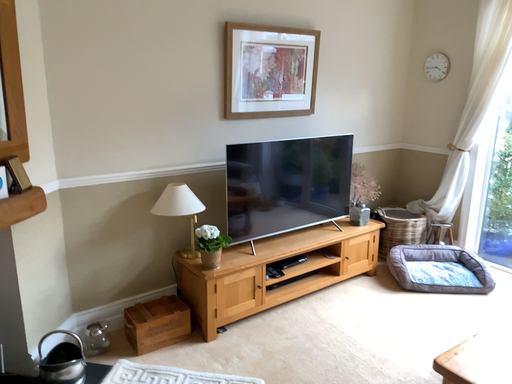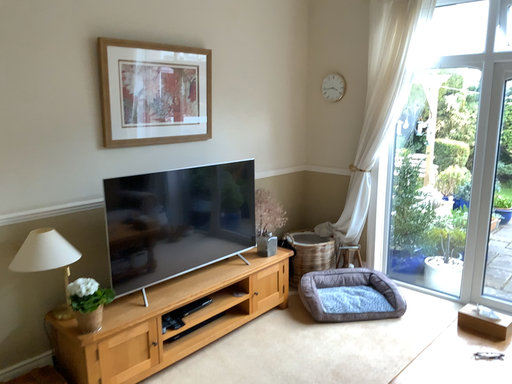
Question: Which way did the camera rotate in the video?

Choices:
 (A) rotated right
 (B) rotated left

Answer: (A)